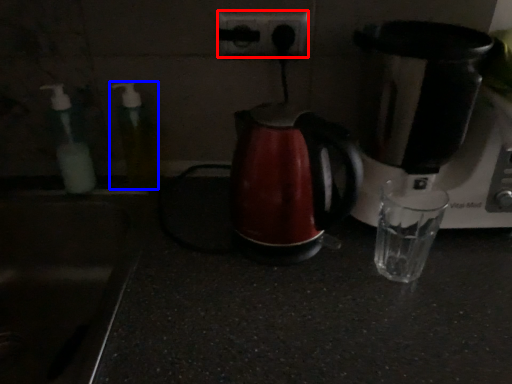
Question: Which object is further to the camera taking this photo, power plugs and sockets (highlighted by a red box) or bottle (highlighted by a blue box)?

Choices:
 (A) power plugs and sockets
 (B) bottle

Answer: (A)